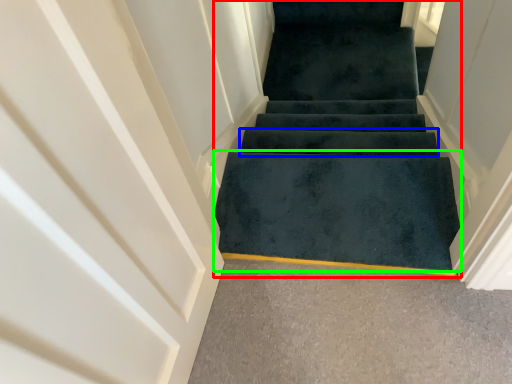
Question: Considering the real-world distances, which object is closest to stairs (highlighted by a red box)? stair (highlighted by a blue box) or doormat (highlighted by a green box).

Choices:
 (A) stair
 (B) doormat

Answer: (A)